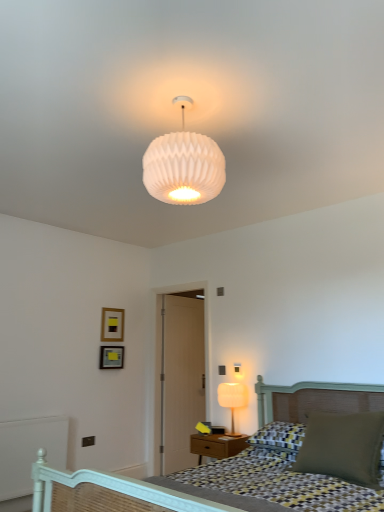
This screenshot has height=512, width=384. What do you see at coordinates (111, 357) in the screenshot?
I see `matte black picture frame at upper left, which appears as the first picture frame when ordered from the bottom` at bounding box center [111, 357].

Measure the distance between matte black picture frame at upper left, which is counted as the second picture frame, starting from the top, and camera.

matte black picture frame at upper left, which is counted as the second picture frame, starting from the top, is 4.47 meters away from camera.

What do you see at coordinates (217, 445) in the screenshot? This screenshot has width=384, height=512. I see `matte wood nightstand at lower center` at bounding box center [217, 445].

Identify the location of matte white lamp at right, placed as the 2th lamp when sorted from front to back. (232, 400).

Describe the element at coordinates (112, 325) in the screenshot. I see `matte gold picture frame at upper left, which is the 2th picture frame from bottom to top` at that location.

At what (x,y) coordinates should I click in order to perform the action: click on wooden door at center. Please return your answer as a coordinate pair (x, y). Looking at the image, I should click on (180, 379).

From a real-world perspective, is white painted wood balustrade at lower left above or below matte black picture frame at upper left, which is counted as the second picture frame, starting from the top?

white painted wood balustrade at lower left is below matte black picture frame at upper left, which is counted as the second picture frame, starting from the top.

Is white painted wood balustrade at lower left positioned with its back to matte black picture frame at upper left, which appears as the first picture frame when ordered from the bottom?

No, matte black picture frame at upper left, which appears as the first picture frame when ordered from the bottom, is not at the back of white painted wood balustrade at lower left.

Which object is thinner, white painted wood balustrade at lower left or matte black picture frame at upper left, which appears as the first picture frame when ordered from the bottom?

matte black picture frame at upper left, which appears as the first picture frame when ordered from the bottom.

Locate an element on the screen. This screenshot has width=384, height=512. picture frame that is the 1st object located behind the white painted wood balustrade at lower left is located at coordinates (111, 357).

Is matte green pillow at lower right smaller than matte gold picture frame at upper left, the 1th picture frame viewed from the top?

Actually, matte green pillow at lower right might be larger than matte gold picture frame at upper left, the 1th picture frame viewed from the top.

What's the angular difference between matte green pillow at lower right and matte gold picture frame at upper left, the 1th picture frame viewed from the top,'s facing directions?

The facing directions of matte green pillow at lower right and matte gold picture frame at upper left, the 1th picture frame viewed from the top, are 90.8 degrees apart.

Is point (306, 462) positioned before point (104, 307)?

Yes, it is.

Which is more to the right, matte green pillow at lower right or matte gold picture frame at upper left, the 1th picture frame viewed from the top?

matte green pillow at lower right is more to the right.

Can you confirm if matte gold picture frame at upper left, the 1th picture frame viewed from the top, is wider than matte white lamp at right, the 1th lamp positioned from the right?

In fact, matte gold picture frame at upper left, the 1th picture frame viewed from the top, might be narrower than matte white lamp at right, the 1th lamp positioned from the right.

From the matte gold picture frame at upper left, the 1th picture frame viewed from the top, count 2nd lamp to the right and point to it. Please provide its 2D coordinates.

[(232, 400)]

Is matte gold picture frame at upper left, the 1th picture frame viewed from the top, positioned with its back to matte white lamp at right, which is the second lamp in top-to-bottom order?

matte gold picture frame at upper left, the 1th picture frame viewed from the top, does not have its back to matte white lamp at right, which is the second lamp in top-to-bottom order.

Which object is positioned more to the right, checkered fabric bed at lower right or matte gold picture frame at upper left, the 1th picture frame viewed from the top?

checkered fabric bed at lower right.

Is checkered fabric bed at lower right bigger than matte gold picture frame at upper left, the 1th picture frame viewed from the top?

Indeed, checkered fabric bed at lower right has a larger size compared to matte gold picture frame at upper left, the 1th picture frame viewed from the top.

Which of these two, checkered fabric bed at lower right or matte gold picture frame at upper left, which is the 2th picture frame from bottom to top, stands shorter?

matte gold picture frame at upper left, which is the 2th picture frame from bottom to top.

The width and height of the screenshot is (384, 512). What are the coordinates of `side behind the checkered fabric bed at lower right` in the screenshot? It's located at (180, 379).

Looking at this image, can we say wooden door at center lies outside checkered fabric bed at lower right?

Yes, wooden door at center is outside of checkered fabric bed at lower right.

Looking at this image, from the image's perspective, is wooden door at center located above checkered fabric bed at lower right?

No, from the image's perspective, wooden door at center is not on top of checkered fabric bed at lower right.

Considering the sizes of objects wooden door at center and checkered fabric bed at lower right in the image provided, who is thinner, wooden door at center or checkered fabric bed at lower right?

With smaller width is wooden door at center.

In the scene shown: Can you tell me how much white ribbed glass lampshade at upper center, the first lamp when ordered from front to back, and matte white lamp at right, placed as the 2th lamp when sorted from front to back, differ in facing direction?

They differ by 180 degrees in their facing directions.

Based on the photo, from the image's perspective, would you say white ribbed glass lampshade at upper center, marked as the 2th lamp in a right-to-left arrangement, is shown under matte white lamp at right, the 1th lamp from the bottom?

No.

Are white ribbed glass lampshade at upper center, the second lamp viewed from the back, and matte white lamp at right, the 1th lamp from the bottom, beside each other?

No, white ribbed glass lampshade at upper center, the second lamp viewed from the back, is not next to matte white lamp at right, the 1th lamp from the bottom.

Is white ribbed glass lampshade at upper center, the second lamp viewed from the back, beside checkered fabric bed at lower right?

No, white ribbed glass lampshade at upper center, the second lamp viewed from the back, is not next to checkered fabric bed at lower right.

Which lamp is the 1st one when counting from the back of the checkered fabric bed at lower right? Please provide its 2D coordinates.

[(184, 165)]

Is white ribbed glass lampshade at upper center, acting as the first lamp starting from the top, positioned before checkered fabric bed at lower right?

No, white ribbed glass lampshade at upper center, acting as the first lamp starting from the top, is further to the viewer.

Is white ribbed glass lampshade at upper center, the first lamp when ordered from front to back, oriented away from checkered fabric bed at lower right?

No, white ribbed glass lampshade at upper center, the first lamp when ordered from front to back, is not facing the opposite direction of checkered fabric bed at lower right.

Identify the location of balustrade in front of the matte black picture frame at upper left, which appears as the first picture frame when ordered from the bottom. This screenshot has height=512, width=384. (29, 451).

Find the location of a particular element. Image resolution: width=384 pixels, height=512 pixels. the 2nd picture frame behind the matte green pillow at lower right, counting from the anchor's position is located at coordinates (112, 325).

Estimate the real-world distances between objects in this image. Which object is further from white painted wood balustrade at lower left, matte black picture frame at upper left, which is counted as the second picture frame, starting from the top, or matte wood nightstand at lower center?

matte wood nightstand at lower center lies further to white painted wood balustrade at lower left than the other object.

Based on the photo, estimate the real-world distances between objects in this image. Which object is closer to white ribbed glass lampshade at upper center, acting as the first lamp starting from the left, white painted wood balustrade at lower left or wooden door at center?

Among the two, white painted wood balustrade at lower left is located nearer to white ribbed glass lampshade at upper center, acting as the first lamp starting from the left.

Which object lies nearer to the anchor point white ribbed glass lampshade at upper center, the first lamp when ordered from front to back, checkered fabric bed at lower right or matte wood nightstand at lower center?

The object closer to white ribbed glass lampshade at upper center, the first lamp when ordered from front to back, is checkered fabric bed at lower right.

Considering their positions, is white painted wood balustrade at lower left positioned closer to matte green pillow at lower right than matte white lamp at right, the 1th lamp from the bottom?

matte white lamp at right, the 1th lamp from the bottom.

Considering their positions, is matte gold picture frame at upper left, which is the 2th picture frame from bottom to top, positioned further to matte black picture frame at upper left, which appears as the first picture frame when ordered from the bottom, than matte green pillow at lower right?

Based on the image, matte green pillow at lower right appears to be further to matte black picture frame at upper left, which appears as the first picture frame when ordered from the bottom.

Looking at the image, which one is located further to wooden door at center, matte black picture frame at upper left, which is counted as the second picture frame, starting from the top, or white ribbed glass lampshade at upper center, marked as the 2th lamp in a right-to-left arrangement?

Based on the image, white ribbed glass lampshade at upper center, marked as the 2th lamp in a right-to-left arrangement, appears to be further to wooden door at center.

Looking at the image, which one is located closer to matte wood nightstand at lower center, matte green pillow at lower right or matte black picture frame at upper left, which is counted as the second picture frame, starting from the top?

matte green pillow at lower right is closer to matte wood nightstand at lower center.

Based on the photo, considering their positions, is matte white lamp at right, which is the second lamp in top-to-bottom order, positioned further to matte gold picture frame at upper left, which is the 2th picture frame from bottom to top, than white painted wood balustrade at lower left?

Among the two, matte white lamp at right, which is the second lamp in top-to-bottom order, is located further to matte gold picture frame at upper left, which is the 2th picture frame from bottom to top.

You are a GUI agent. You are given a task and a screenshot of the screen. Output one action in this format:
    pyautogui.click(x=<x>, y=<y>)
    Task: Click on the pillow between white ribbed glass lampshade at upper center, the first lamp when ordered from front to back, and matte white lamp at right, which appears as the 1th lamp when viewed from the back, from top to bottom
    This screenshot has width=384, height=512.
    Given the screenshot: What is the action you would take?
    pyautogui.click(x=343, y=447)

Find the location of `lamp positioned between checkered fabric bed at lower right and white painted wood balustrade at lower left from near to far`. lamp positioned between checkered fabric bed at lower right and white painted wood balustrade at lower left from near to far is located at coordinates (184, 165).

This screenshot has height=512, width=384. Find the location of `pillow positioned between checkered fabric bed at lower right and matte white lamp at right, which is the second lamp in top-to-bottom order, from near to far`. pillow positioned between checkered fabric bed at lower right and matte white lamp at right, which is the second lamp in top-to-bottom order, from near to far is located at coordinates (343, 447).

Locate an element on the screen. The image size is (384, 512). pillow between checkered fabric bed at lower right and wooden door at center in the front-back direction is located at coordinates click(x=343, y=447).